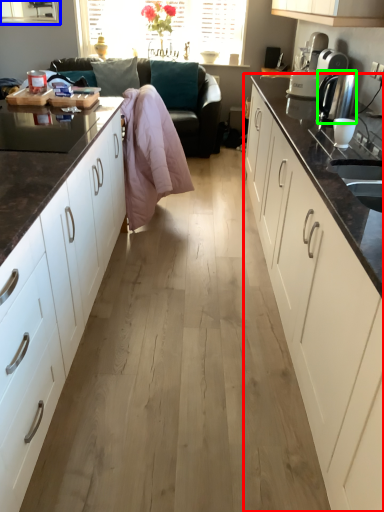
Question: Based on their relative distances, which object is nearer to cabinetry (highlighted by a red box)? Choose from window (highlighted by a blue box) and kitchen appliance (highlighted by a green box).

Choices:
 (A) window
 (B) kitchen appliance

Answer: (B)